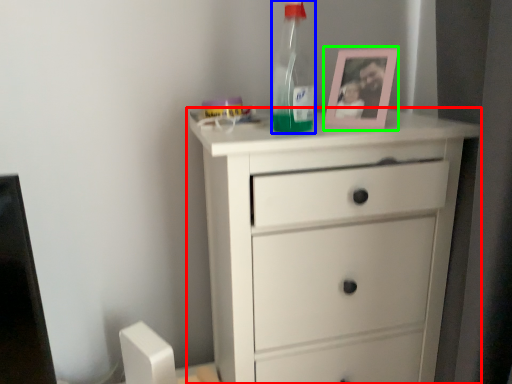
Question: Which object is the farthest from chest of drawers (highlighted by a red box)? Choose among these: bottle (highlighted by a blue box) or picture frame (highlighted by a green box).

Choices:
 (A) bottle
 (B) picture frame

Answer: (A)